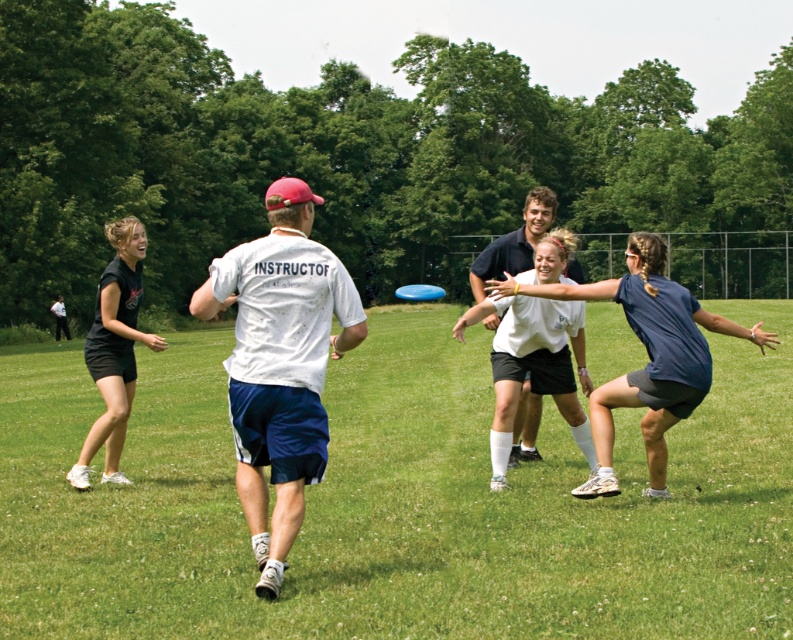
In the scene shown: Is green grass at center bigger than black matte shorts at left?

Indeed, green grass at center has a larger size compared to black matte shorts at left.

Does green grass at center lie behind black matte shorts at left?

No, green grass at center is in front of black matte shorts at left.

Who is more forward, (x=90, y=589) or (x=117, y=368)?

Positioned in front is point (x=90, y=589).

At what (x,y) coordinates should I click in order to perform the action: click on green grass at center. Please return your answer as a coordinate pair (x, y). This screenshot has width=793, height=640. Looking at the image, I should click on (396, 502).

This screenshot has width=793, height=640. What do you see at coordinates (648, 355) in the screenshot? I see `dark blue jersey at center` at bounding box center [648, 355].

Is the position of dark blue jersey at center more distant than that of blue plastic frisbee at center?

No.

Where is `dark blue jersey at center`? The width and height of the screenshot is (793, 640). dark blue jersey at center is located at coordinates (648, 355).

Between white matte shirt at center and dark blue jersey at center, which one appears on the left side from the viewer's perspective?

Positioned to the left is white matte shirt at center.

Is the position of white matte shirt at center more distant than that of dark blue jersey at center?

No, it is not.

Which is in front, point (297, 385) or point (640, 326)?

Point (297, 385)

Identify the location of white matte shirt at center. The height and width of the screenshot is (640, 793). (280, 364).